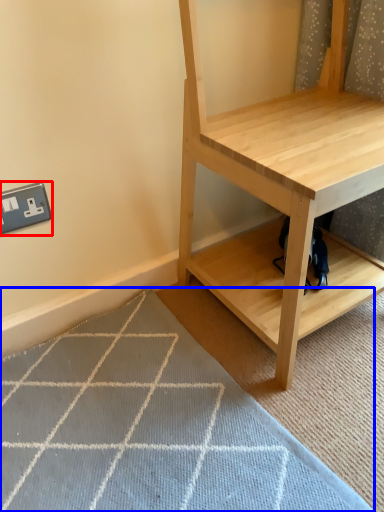
Question: Which point is closer to the camera, electric outlet (highlighted by a red box) or doormat (highlighted by a blue box)?

Choices:
 (A) electric outlet
 (B) doormat

Answer: (B)